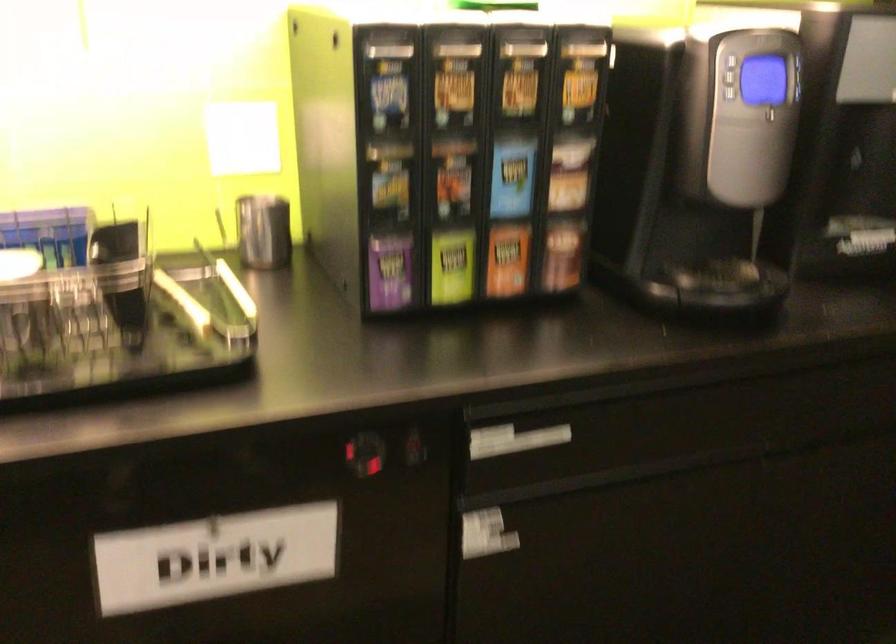
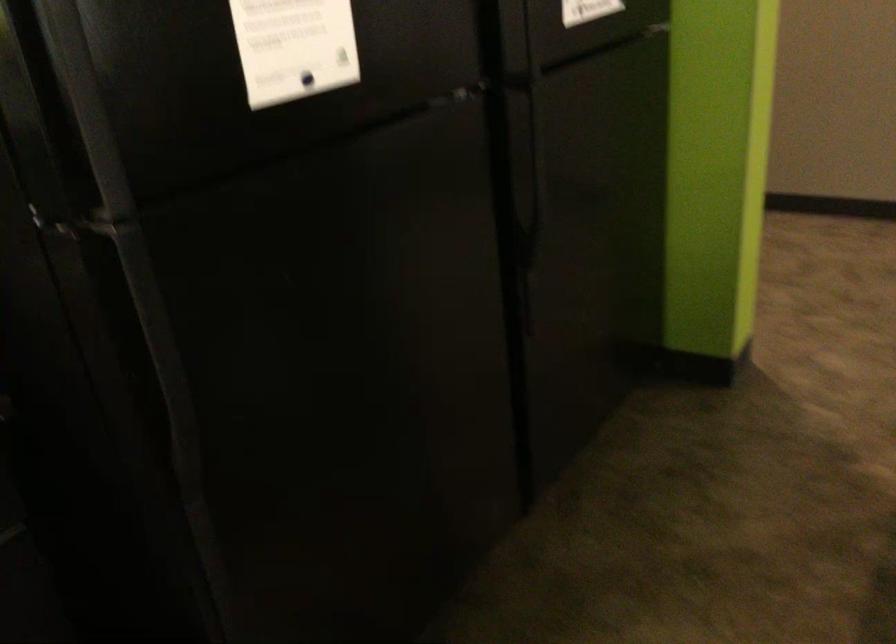
Question: The first image is from the beginning of the video and the second image is from the end. How did the camera likely rotate when shooting the video?

Choices:
 (A) Left
 (B) Right
 (C) Up
 (D) Down

Answer: (B)